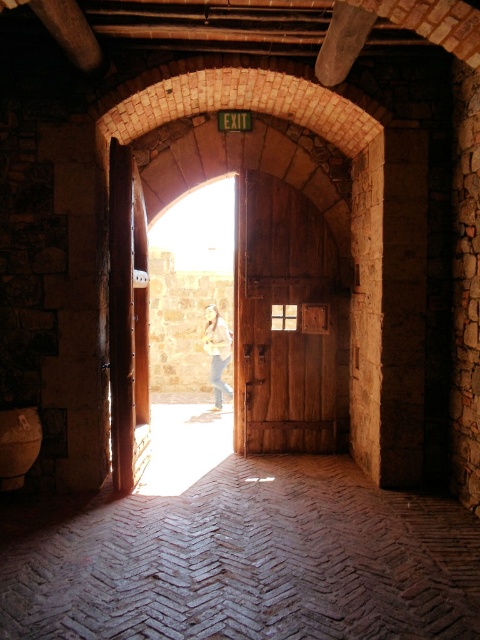
Which is more to the left, wooden door at center or light brown leather jacket at center?

light brown leather jacket at center is more to the left.

Is point (300, 448) positioned in front of point (216, 312)?

Yes, point (300, 448) is in front of point (216, 312).

The width and height of the screenshot is (480, 640). What do you see at coordinates (283, 321) in the screenshot? I see `wooden door at center` at bounding box center [283, 321].

The width and height of the screenshot is (480, 640). Identify the location of wooden door at center. (283, 321).